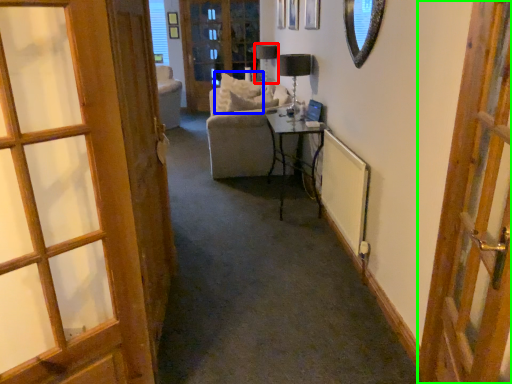
Question: Which is nearer to the table lamp (highlighted by a red box)? pillow (highlighted by a blue box) or door (highlighted by a green box).

Choices:
 (A) pillow
 (B) door

Answer: (A)